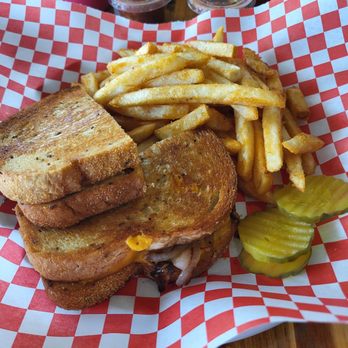
The height and width of the screenshot is (348, 348). Find the location of `table`. table is located at coordinates (274, 338).